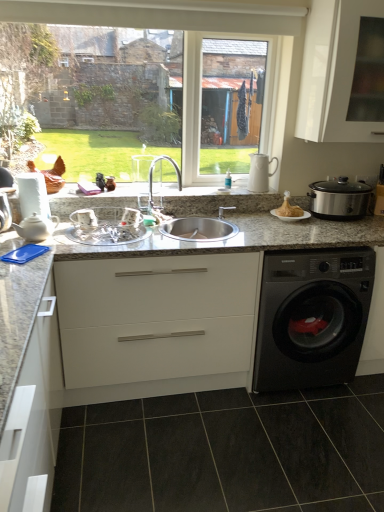
Question: Relative to white ceramic pitcher at upper right, the 2th appliance from the right, is silver metallic faucet at center in front or behind?

Choices:
 (A) front
 (B) behind

Answer: (A)

Question: From their relative heights in the image, would you say silver metallic faucet at center is taller or shorter than white ceramic pitcher at upper right, the 2th appliance from the right?

Choices:
 (A) tall
 (B) short

Answer: (A)

Question: Which of these objects is positioned closest to the golden crispy turkey at center?

Choices:
 (A) white matte cabinet at lower left, which is the first cabinetry from left to right
 (B) silver metallic faucet at center
 (C) clear glass window at upper center
 (D) clear glass bowl at center, marked as the 3th appliance in a right-to-left arrangement
 (E) black glossy washing machine at lower right

Answer: (E)

Question: Which of these objects is positioned farthest from the black glossy washing machine at lower right?

Choices:
 (A) white matte cabinet at center, acting as the 2th cabinetry starting from the left
 (B) silver metallic faucet at center
 (C) dark gray tile at lower center
 (D) white ceramic pitcher at upper right, the second appliance in the left-to-right sequence
 (E) white glossy cabinet at upper right, the third cabinetry from the left

Answer: (B)